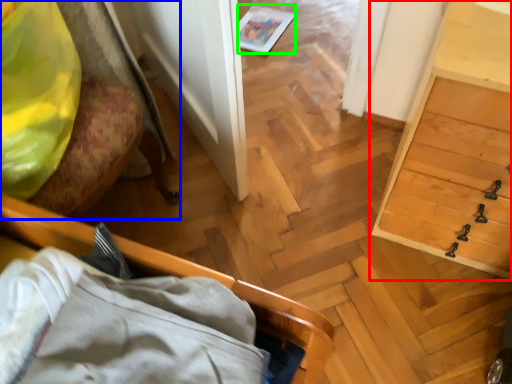
Question: Which object is the closest to the dresser (highlighted by a red box)? Choose among these: furniture (highlighted by a blue box) or magazine (highlighted by a green box).

Choices:
 (A) furniture
 (B) magazine

Answer: (A)